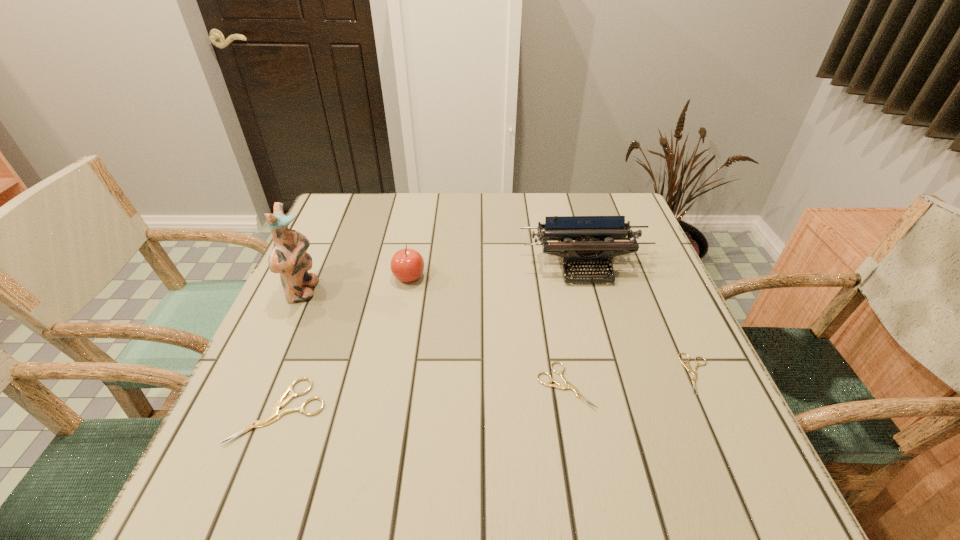
Locate an element on the screen. free space between the fifth tallest object and the figurine is located at coordinates (434, 339).

You are a GUI agent. You are given a task and a screenshot of the screen. Output one action in this format:
    pyautogui.click(x=<x>, y=<y>)
    Task: Click on the vacant point located between the fourth tallest object and the second shears from right to left
    This screenshot has width=960, height=540.
    Given the screenshot: What is the action you would take?
    pyautogui.click(x=422, y=398)

Where is `vacant space in between the tallest shears and the second tallest shears`? This screenshot has height=540, width=960. vacant space in between the tallest shears and the second tallest shears is located at coordinates (422, 398).

Identify the location of vacant region between the typewriter and the fourth object from right to left. The width and height of the screenshot is (960, 540). (496, 272).

At what (x,y) coordinates should I click in order to perform the action: click on unoccupied position between the apple and the shortest object. Please return your answer as a coordinate pair (x, y). Image resolution: width=960 pixels, height=540 pixels. Looking at the image, I should click on (553, 325).

The image size is (960, 540). Find the location of `vacant point located between the rightmost shears and the tallest object`. vacant point located between the rightmost shears and the tallest object is located at coordinates (500, 333).

Point out which object is positioned as the fourth nearest to the shortest object. Please provide its 2D coordinates. Your answer should be formatted as a tuple, i.e. [(x, y)], where the tuple contains the x and y coordinates of a point satisfying the conditions above.

[(275, 413)]

Point out which object is positioned as the second nearest to the third tallest object. Please provide its 2D coordinates. Your answer should be formatted as a tuple, i.e. [(x, y)], where the tuple contains the x and y coordinates of a point satisfying the conditions above.

[(594, 246)]

This screenshot has width=960, height=540. I want to click on the second closest shears to the tallest shears, so click(x=688, y=367).

Identify which shears is located as the second nearest to the fifth shortest object. Please provide its 2D coordinates. Your answer should be formatted as a tuple, i.e. [(x, y)], where the tuple contains the x and y coordinates of a point satisfying the conditions above.

[(567, 385)]